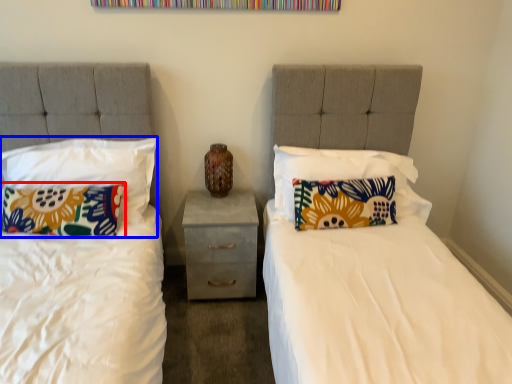
Question: Which object is further to the camera taking this photo, pillow (highlighted by a red box) or pillow (highlighted by a blue box)?

Choices:
 (A) pillow
 (B) pillow

Answer: (A)